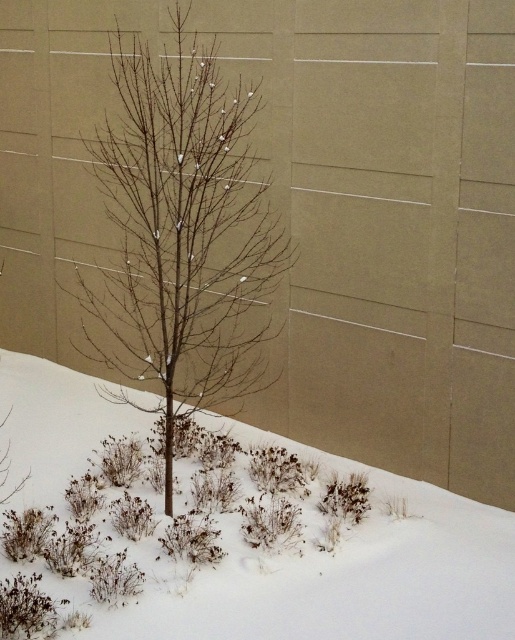
In the scene shown: You are an animal trying to cross the snow without stepping on the branches. Can you walk safely through the area where the white fluffy snow at center and the bare branches at center are located?

The white fluffy snow at center might be wider than the bare branches at center, so there is a possibility that the snow is wide enough to provide a safe path. However, since the branches are also present at the center, there might be some overlapping areas where stepping could be risky. It depends on the exact width comparison between the snow and branches.

You are an animal trying to build a nest using materials from the scene. The white fluffy snow at center and the bare branches at center are both available. Which material would you choose and why?

You should choose the bare branches at center because they are smaller in size than the white fluffy snow at center, making them easier to handle and construct a sturdy nest.